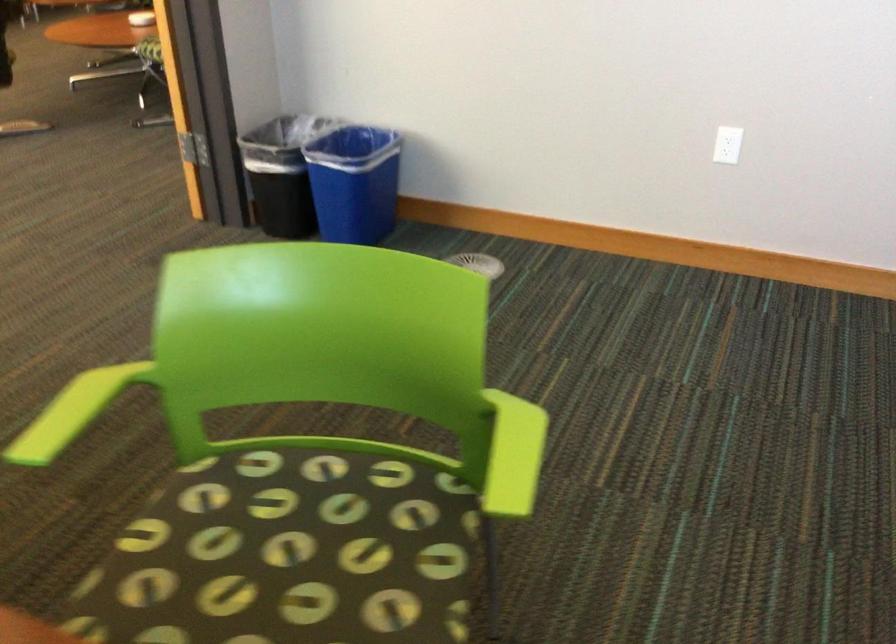
This screenshot has height=644, width=896. Find the location of `white wall outlet`. white wall outlet is located at coordinates (728, 144).